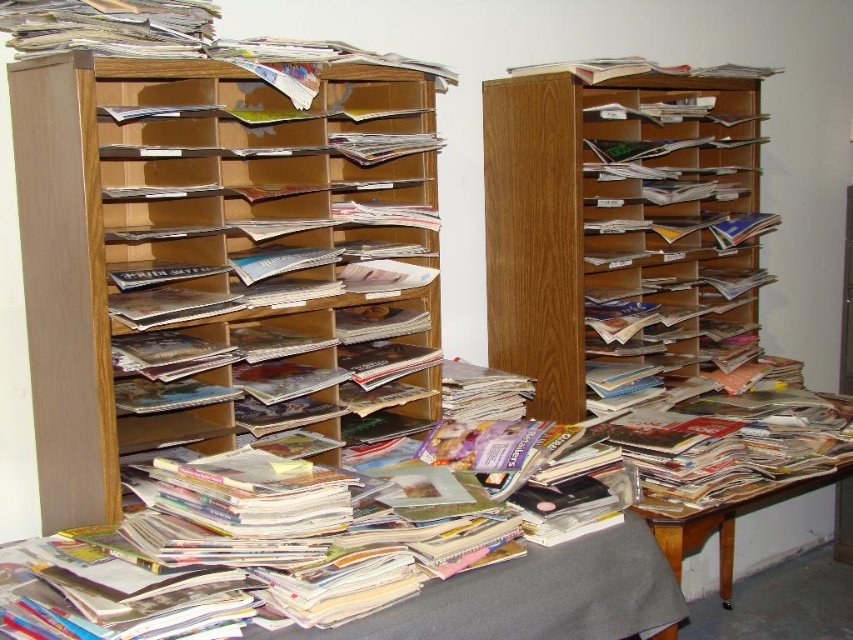
Question: Which point is closer to the camera?

Choices:
 (A) gray fabric at lower center
 (B) wooden bookshelf at center
 (C) matte paper magazine at center

Answer: (A)

Question: From the image, what is the correct spatial relationship of wooden bookshelf at center in relation to wooden table at lower right?

Choices:
 (A) right
 (B) left

Answer: (B)

Question: Which object is the closest to the wooden bookshelf at center?

Choices:
 (A) wooden magazine rack at left
 (B) gray fabric at lower center
 (C) wooden table at lower right

Answer: (A)

Question: Observing the image, what is the correct spatial positioning of wooden magazine rack at left in reference to wooden table at lower right?

Choices:
 (A) above
 (B) below

Answer: (A)

Question: Among these objects, which one is farthest from the camera?

Choices:
 (A) wooden table at lower right
 (B) matte paper magazine at center
 (C) wooden bookshelf at center
 (D) gray fabric at lower center

Answer: (A)

Question: Does wooden bookshelf at center come behind wooden table at lower right?

Choices:
 (A) no
 (B) yes

Answer: (A)